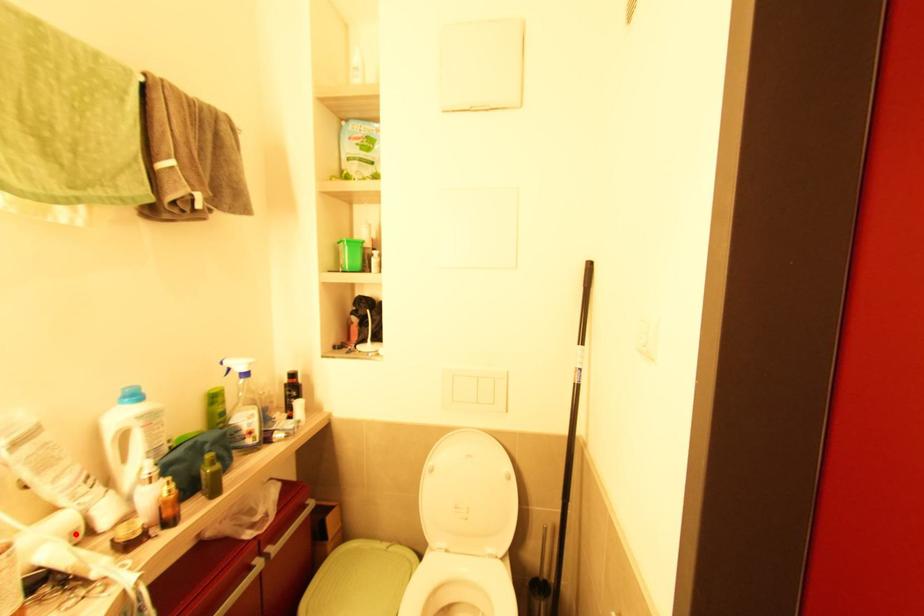
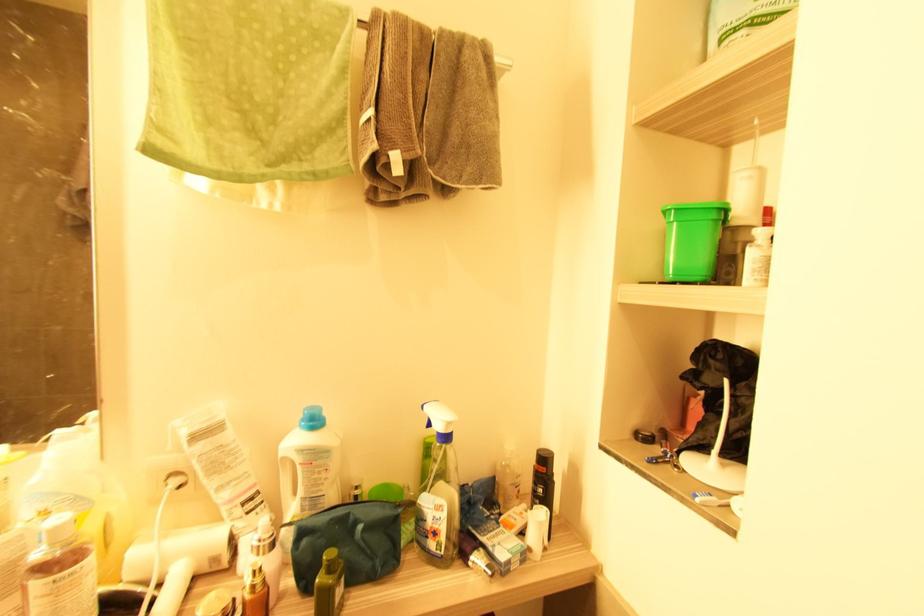
Locate, in the second image, the point that corresponds to the highlighted location in the first image.

(216, 561)